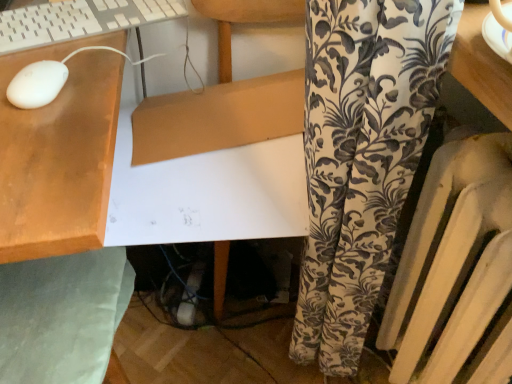
Question: Is white plastic radiator at right further to the viewer compared to green fabric swivel chair at lower left?

Choices:
 (A) yes
 (B) no

Answer: (B)

Question: From a real-world perspective, is white plastic radiator at right physically above green fabric swivel chair at lower left?

Choices:
 (A) yes
 (B) no

Answer: (B)

Question: Is white plastic radiator at right wider than green fabric swivel chair at lower left?

Choices:
 (A) no
 (B) yes

Answer: (A)

Question: Considering the relative sizes of white plastic radiator at right and green fabric swivel chair at lower left in the image provided, is white plastic radiator at right thinner than green fabric swivel chair at lower left?

Choices:
 (A) no
 (B) yes

Answer: (B)

Question: Is white plastic radiator at right surrounding green fabric swivel chair at lower left?

Choices:
 (A) yes
 (B) no

Answer: (B)

Question: In terms of width, does white matte mouse at upper left look wider or thinner when compared to white plastic radiator at right?

Choices:
 (A) thin
 (B) wide

Answer: (A)

Question: Choose the correct answer: Is white matte mouse at upper left inside white plastic radiator at right or outside it?

Choices:
 (A) inside
 (B) outside

Answer: (B)

Question: In terms of height, does white matte mouse at upper left look taller or shorter compared to white plastic radiator at right?

Choices:
 (A) short
 (B) tall

Answer: (A)

Question: Relative to white plastic radiator at right, is white matte mouse at upper left in front or behind?

Choices:
 (A) front
 (B) behind

Answer: (B)

Question: Does point (53, 61) appear closer or farther from the camera than point (18, 271)?

Choices:
 (A) closer
 (B) farther

Answer: (A)

Question: Choose the correct answer: Is white matte mouse at upper left inside green fabric swivel chair at lower left or outside it?

Choices:
 (A) inside
 (B) outside

Answer: (B)

Question: From their relative heights in the image, would you say white matte mouse at upper left is taller or shorter than green fabric swivel chair at lower left?

Choices:
 (A) tall
 (B) short

Answer: (B)

Question: Is white matte mouse at upper left to the left or to the right of green fabric swivel chair at lower left in the image?

Choices:
 (A) left
 (B) right

Answer: (B)

Question: Is green fabric swivel chair at lower left in front of or behind white matte mouse at upper left in the image?

Choices:
 (A) front
 (B) behind

Answer: (A)

Question: Is green fabric swivel chair at lower left taller or shorter than white matte mouse at upper left?

Choices:
 (A) tall
 (B) short

Answer: (A)